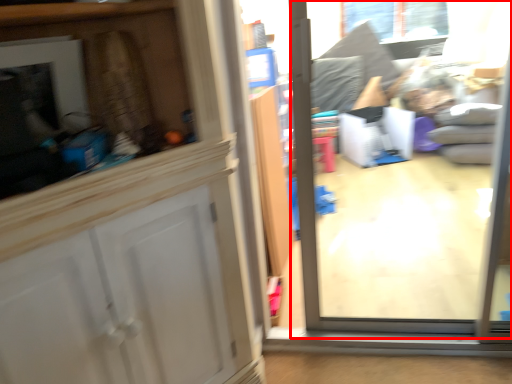
Question: In this image, where is glass door (annotated by the red box) located relative to window?

Choices:
 (A) right
 (B) left

Answer: (B)